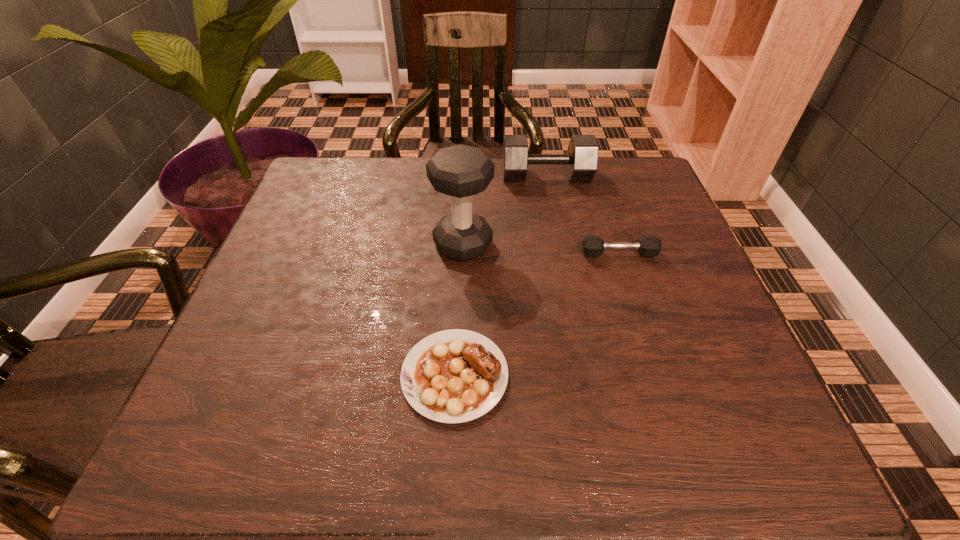
At what (x,y) coordinates should I click in order to perform the action: click on vacant point located 0.300m on the right of the shortest object. Please return your answer as a coordinate pair (x, y). This screenshot has width=960, height=540. Looking at the image, I should click on (x=682, y=375).

The width and height of the screenshot is (960, 540). What are the coordinates of `object present at the far edge` in the screenshot? It's located at 582,154.

Where is `object at the near edge`? Image resolution: width=960 pixels, height=540 pixels. object at the near edge is located at coordinates (452, 376).

You are a GUI agent. You are given a task and a screenshot of the screen. Output one action in this format:
    pyautogui.click(x=<x>, y=<y>)
    Task: Click on the object that is at the right edge
    
    Given the screenshot: What is the action you would take?
    pyautogui.click(x=592, y=246)

Where is `free space at the far edge`? free space at the far edge is located at coordinates (491, 158).

Identify the location of free space at the near edge of the desktop. (504, 438).

This screenshot has width=960, height=540. In the image, there is a desktop. Identify the location of vacant space at the left edge. tap(236, 389).

Find the location of a particular element. vacant space at the right edge is located at coordinates (705, 341).

Find the location of a particular element. free location at the far left corner of the desktop is located at coordinates (310, 177).

The height and width of the screenshot is (540, 960). Find the location of `vacant region at the near left corner of the desktop`. vacant region at the near left corner of the desktop is located at coordinates (240, 425).